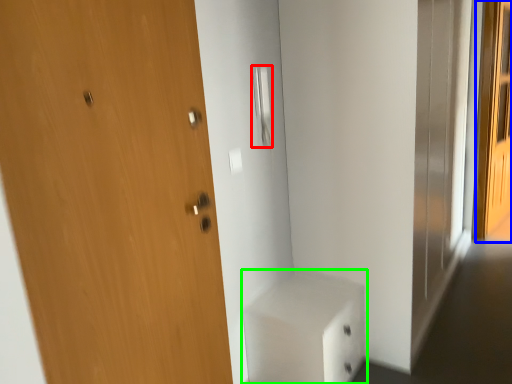
Question: Which object is the closest to the door handle (highlighted by a red box)? Choose among these: screen door (highlighted by a blue box) or cabinetry (highlighted by a green box).

Choices:
 (A) screen door
 (B) cabinetry

Answer: (B)